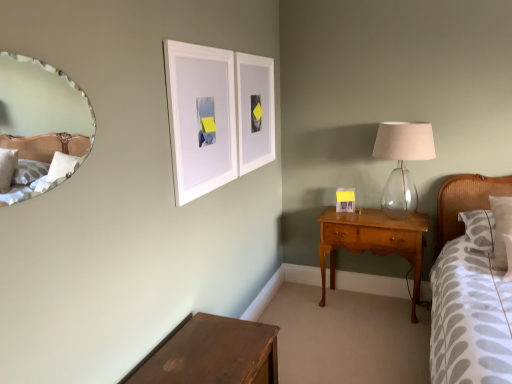
Question: Does dark brown wooden table at lower left have a greater width compared to white matte picture frame at upper center, which is counted as the second picture frame, starting from the back?

Choices:
 (A) no
 (B) yes

Answer: (B)

Question: Is dark brown wooden table at lower left not near white matte picture frame at upper center, which appears as the second picture frame when viewed from the right?

Choices:
 (A) yes
 (B) no

Answer: (A)

Question: Is dark brown wooden table at lower left facing away from white matte picture frame at upper center, the second picture frame viewed from the front?

Choices:
 (A) yes
 (B) no

Answer: (B)

Question: Considering the relative positions of dark brown wooden table at lower left and white matte picture frame at upper center, the second picture frame in the left-to-right sequence, in the image provided, is dark brown wooden table at lower left to the right of white matte picture frame at upper center, the second picture frame in the left-to-right sequence, from the viewer's perspective?

Choices:
 (A) yes
 (B) no

Answer: (B)

Question: Is dark brown wooden table at lower left positioned in front of white matte picture frame at upper center, which appears as the second picture frame when viewed from the right?

Choices:
 (A) yes
 (B) no

Answer: (A)

Question: Considering the relative sizes of dark brown wooden table at lower left and white matte picture frame at upper center, which is counted as the second picture frame, starting from the back, in the image provided, is dark brown wooden table at lower left shorter than white matte picture frame at upper center, which is counted as the second picture frame, starting from the back,?

Choices:
 (A) yes
 (B) no

Answer: (A)

Question: Is dark brown wooden table at lower left positioned with its back to clear glass lampshade at right?

Choices:
 (A) no
 (B) yes

Answer: (A)

Question: Could you tell me if dark brown wooden table at lower left is facing clear glass lampshade at right?

Choices:
 (A) yes
 (B) no

Answer: (B)

Question: Are dark brown wooden table at lower left and clear glass lampshade at right making contact?

Choices:
 (A) yes
 (B) no

Answer: (B)

Question: From a real-world perspective, is dark brown wooden table at lower left located beneath clear glass lampshade at right?

Choices:
 (A) yes
 (B) no

Answer: (A)

Question: Does dark brown wooden table at lower left contain clear glass lampshade at right?

Choices:
 (A) no
 (B) yes

Answer: (A)

Question: Can you confirm if dark brown wooden table at lower left is positioned to the right of clear glass lampshade at right?

Choices:
 (A) yes
 (B) no

Answer: (B)

Question: Is white matte picture frame at upper center, acting as the 3th picture frame starting from the back, shorter than matte white picture frame at right, marked as the first picture frame in a right-to-left arrangement?

Choices:
 (A) yes
 (B) no

Answer: (B)